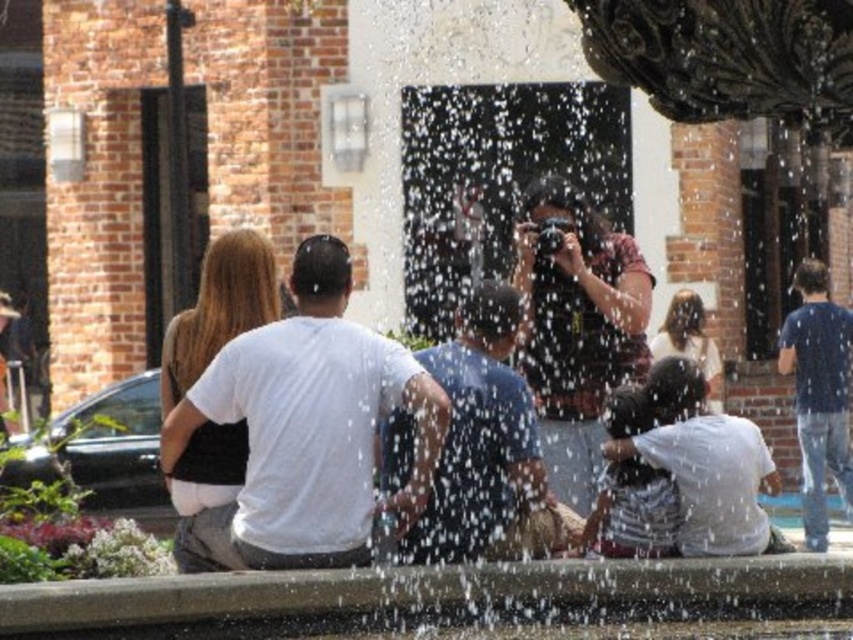
You are standing at the center of the fountain and want to take a photo of both the point at coordinates point (294, 349) and point (811, 372). Which point should you focus on first to ensure both are in the frame?

Since point (294, 349) is in front of point (811, 372), you should focus on point (294, 349) first to ensure both are in the frame.

You are standing at the point closer to the camera between point (566, 468) and point (694, 493). Which point is closer to you?

Point (694, 493) is closer to you because it is in front of point (566, 468).

You are standing in the scene and want to take a photo of the white cotton shirt at lower right without the matte black camera at center appearing in the frame. Which direction should you move to achieve this?

Move to the left side of the scene so that the white cotton shirt at lower right is visible while the matte black camera at center is out of frame.